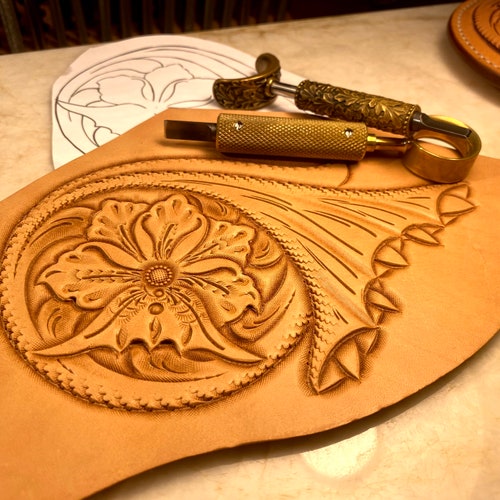
At what (x,y) coordinates should I click in order to perform the action: click on table. Please return your answer as a coordinate pair (x, y). This screenshot has width=500, height=500. Looking at the image, I should click on (423, 454).